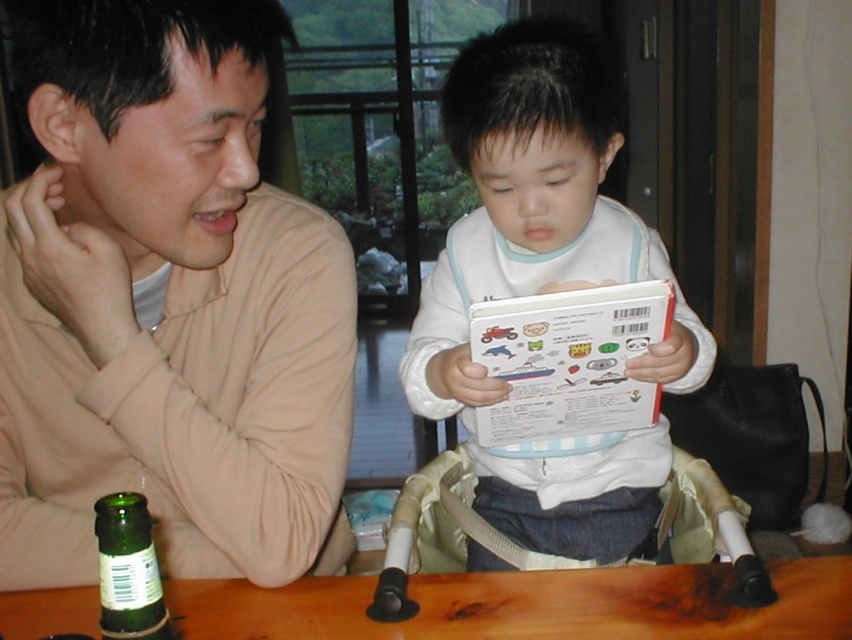
Which is more to the left, wooden table at lower center or green glass bottle at lower left?

From the viewer's perspective, green glass bottle at lower left appears more on the left side.

Can you confirm if wooden table at lower center is shorter than green glass bottle at lower left?

Yes, wooden table at lower center is shorter than green glass bottle at lower left.

The image size is (852, 640). I want to click on wooden table at lower center, so pos(530,605).

Between point (504, 154) and point (740, 612), which one is positioned behind?

The point (504, 154) is behind.

Who is more forward, (468,248) or (640,588)?

Point (640,588)

This screenshot has height=640, width=852. What are the coordinates of `white matte book at center` in the screenshot? It's located at tap(522, 196).

Which of these two, beige soft shirt at upper left or wooden table at lower center, stands taller?

beige soft shirt at upper left is taller.

Between point (252, 164) and point (758, 628), which one is positioned behind?

The point (758, 628) is more distant.

This screenshot has height=640, width=852. What do you see at coordinates (165, 304) in the screenshot?
I see `beige soft shirt at upper left` at bounding box center [165, 304].

Locate an element on the screen. The height and width of the screenshot is (640, 852). beige soft shirt at upper left is located at coordinates point(165,304).